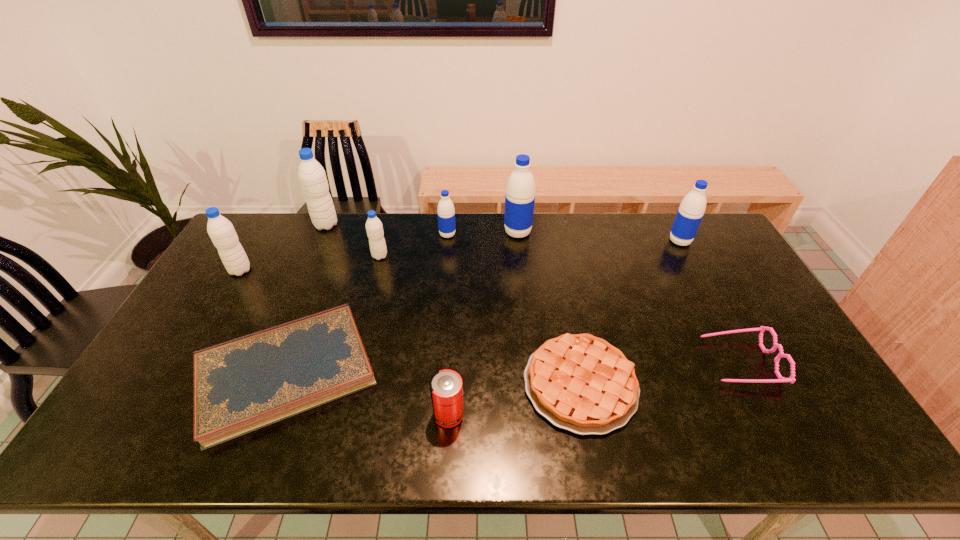
Locate an element on the screen. This screenshot has width=960, height=540. the fifth farthest object is located at coordinates (374, 228).

This screenshot has height=540, width=960. What are the coordinates of `the fourth water bottle from right to left` in the screenshot? It's located at (374, 228).

The width and height of the screenshot is (960, 540). What are the coordinates of `can` in the screenshot? It's located at tap(446, 388).

Identify the location of pink spectacles. (791, 379).

Image resolution: width=960 pixels, height=540 pixels. What are the coordinates of `the eighth tallest object` in the screenshot? It's located at (791, 379).

Locate an element on the screen. the ninth tallest object is located at coordinates (581, 383).

Locate an element on the screen. paperback book is located at coordinates (244, 384).

The width and height of the screenshot is (960, 540). Identify the location of vacant space located 0.170m on the left of the farthest gray water bottle. (268, 225).

Where is `free point located on the right of the second blue water bottle from right to left`? Image resolution: width=960 pixels, height=540 pixels. free point located on the right of the second blue water bottle from right to left is located at coordinates (638, 233).

Identify the location of free space located on the front of the nearest water bottle. Image resolution: width=960 pixels, height=540 pixels. (214, 314).